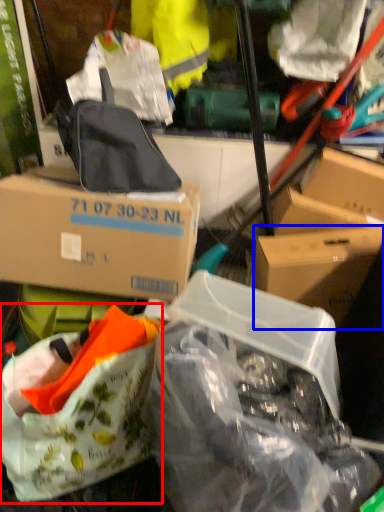
Question: Which object is further to the camera taking this photo, handbag (highlighted by a red box) or box (highlighted by a blue box)?

Choices:
 (A) handbag
 (B) box

Answer: (B)